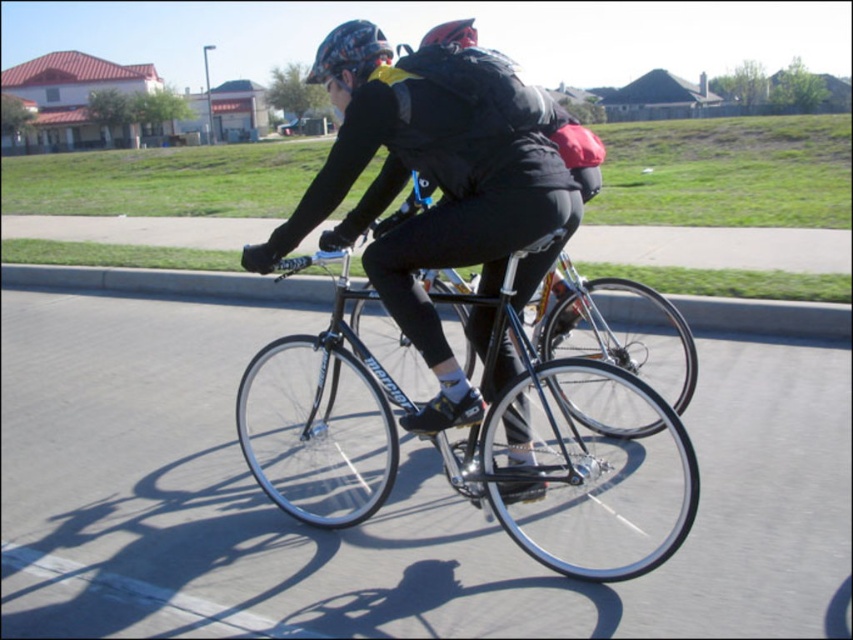
You are standing at the point labeled as point (442, 195). What object is located exactly at this point?

The object at point (442, 195) is the matte black bicycle at center.

You are a drone operator trying to capture aerial footage of the matte black bicycle at center. The camera is currently positioned at point 0.306, 0.519. Is the camera already aligned with the bicycle?

Yes, the camera is already aligned with the matte black bicycle at center because its 2D location matches the coordinates provided.